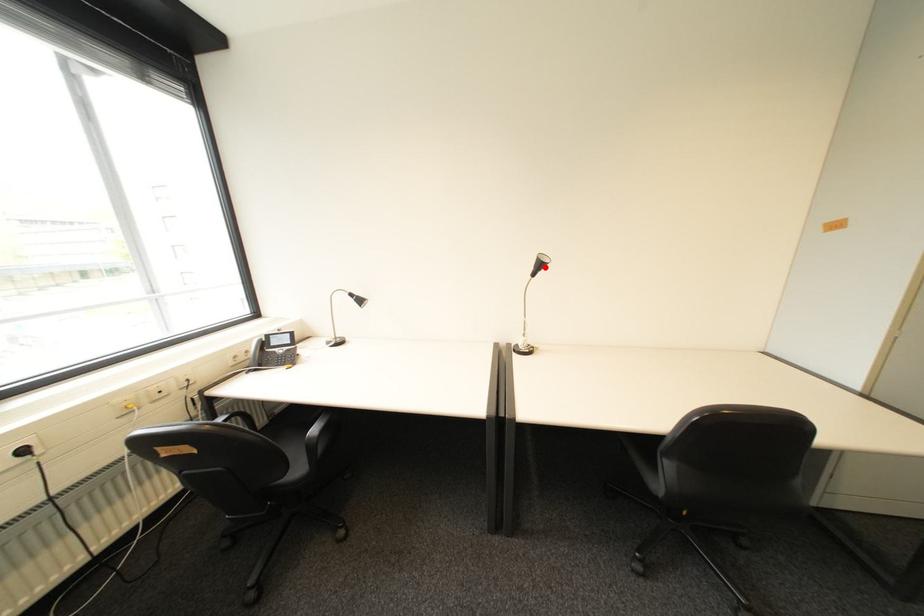
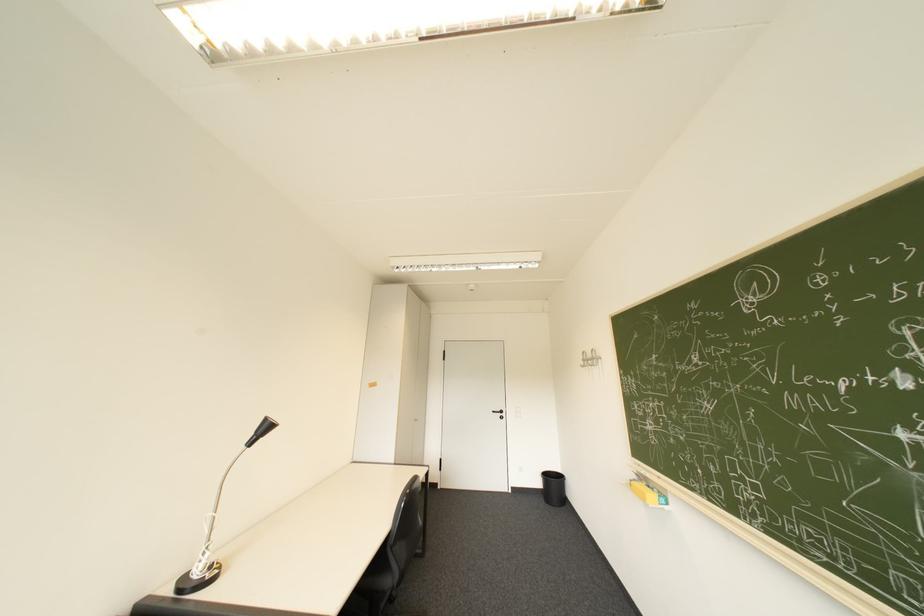
Question: I am providing you with two images of the same scene from different viewpoints. A red point is marked on the first image. Is the red point's position out of view in image 2?

Choices:
 (A) Yes
 (B) No

Answer: (B)